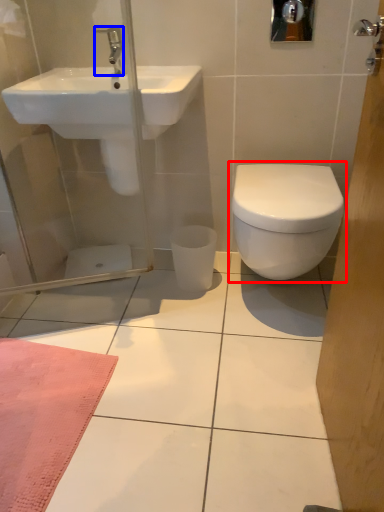
Question: Among these objects, which one is nearest to the camera, toilet (highlighted by a red box) or tap (highlighted by a blue box)?

Choices:
 (A) toilet
 (B) tap

Answer: (A)